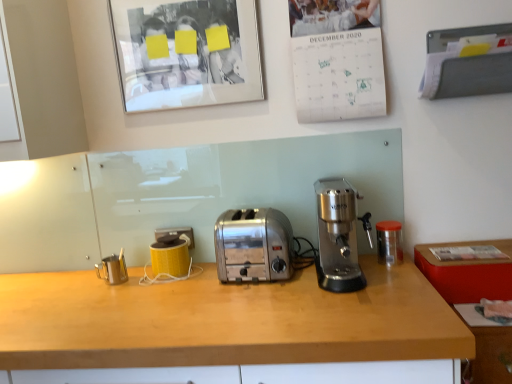
The width and height of the screenshot is (512, 384). I want to click on vacant area that is in front of satin silver coffee maker at center, so click(360, 297).